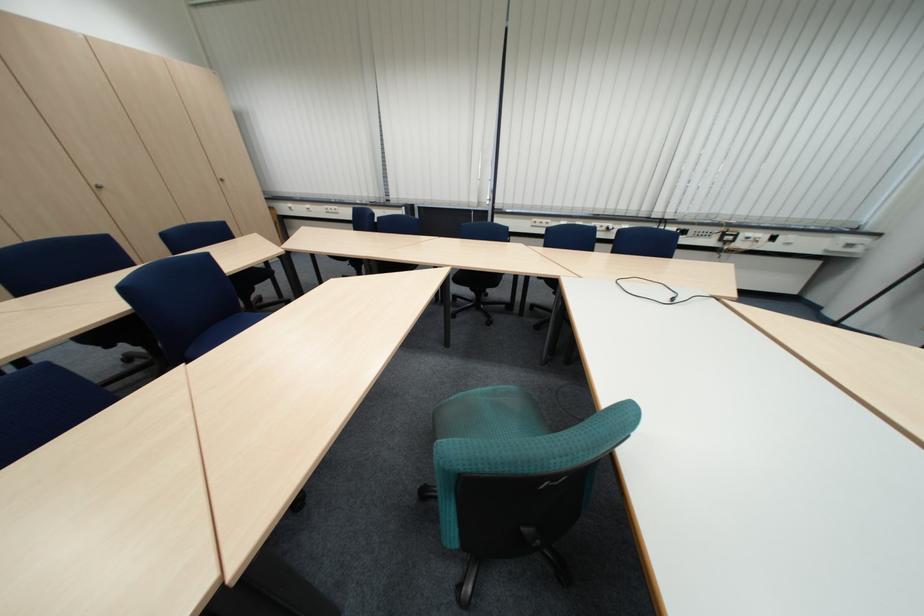
The image size is (924, 616). I want to click on black USB plug, so tap(673, 299).